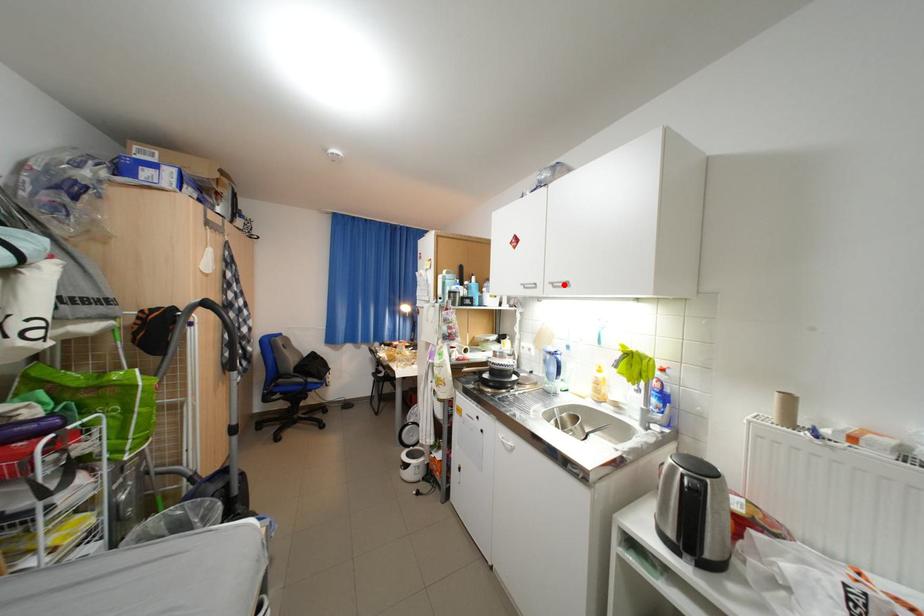
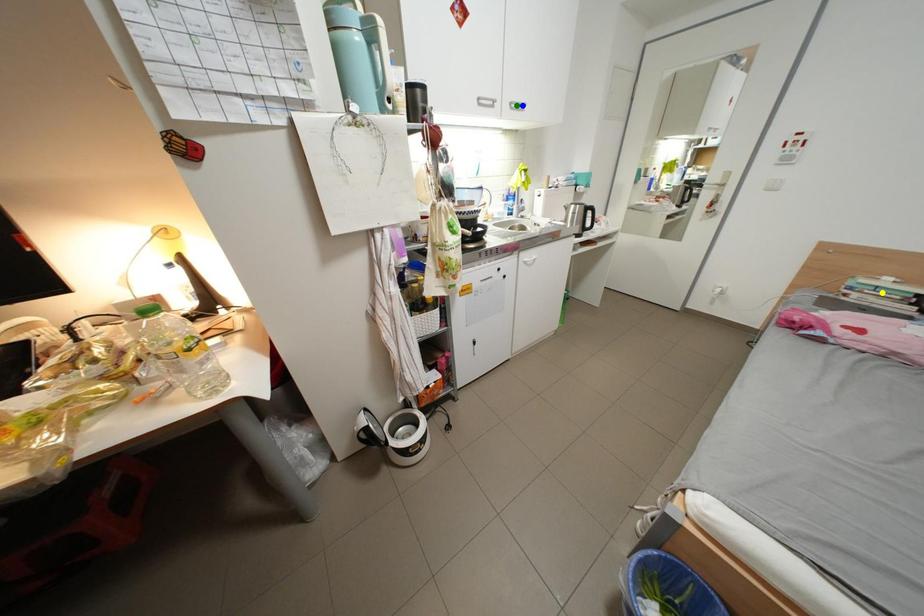
Question: I am providing you with two images of the same scene from different viewpoints. A red point is marked on the first image. You are given multiple points on the second image. Can you choose the point in image 2 that corresponds to the point in image 1?

Choices:
 (A) blue point
 (B) yellow point
 (C) green point

Answer: (A)